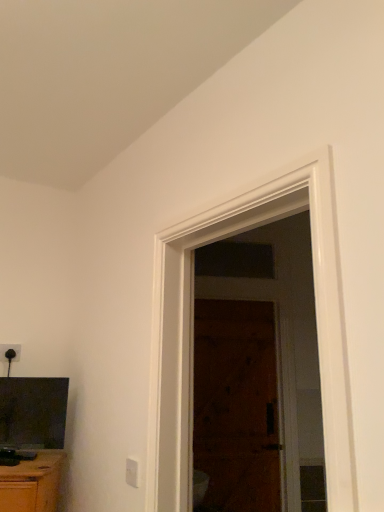
Describe the element at coordinates (33, 439) in the screenshot. I see `matte black tv at lower left` at that location.

What do you see at coordinates (236, 406) in the screenshot?
I see `wooden door at center` at bounding box center [236, 406].

Describe the element at coordinates (258, 372) in the screenshot. The width and height of the screenshot is (384, 512). I see `brown wooden screen door at center` at that location.

The image size is (384, 512). I want to click on white plastic electric outlet at lower center, which is the 2th electric outlet in back-to-front order, so click(x=132, y=472).

Find the location of a particular element. The height and width of the screenshot is (512, 384). electric outlet that is in front of the black plastic electric outlet at upper left, the first electric outlet viewed from the left is located at coordinates (132, 472).

Does white plastic electric outlet at lower center, which is counted as the second electric outlet, starting from the top, contain black plastic electric outlet at upper left, marked as the 2th electric outlet in a front-to-back arrangement?

No, black plastic electric outlet at upper left, marked as the 2th electric outlet in a front-to-back arrangement, is not surrounded by white plastic electric outlet at lower center, which is counted as the second electric outlet, starting from the top.

Which of these two, white plastic electric outlet at lower center, which is the 2th electric outlet in back-to-front order, or black plastic electric outlet at upper left, the 2th electric outlet from the right, stands taller?

white plastic electric outlet at lower center, which is the 2th electric outlet in back-to-front order.

Between white plastic electric outlet at lower center, which is counted as the second electric outlet, starting from the top, and black plastic electric outlet at upper left, the first electric outlet viewed from the left, which one appears on the left side from the viewer's perspective?

Positioned to the left is black plastic electric outlet at upper left, the first electric outlet viewed from the left.

Does point (49, 399) appear closer or farther from the camera than point (220, 348)?

Clearly, point (49, 399) is closer to the camera than point (220, 348).

Between matte black tv at lower left and wooden door at center, which one has less height?

With less height is matte black tv at lower left.

Could you tell me if matte black tv at lower left is turned towards wooden door at center?

No, matte black tv at lower left is not aimed at wooden door at center.

Is there a large distance between matte black tv at lower left and wooden door at center?

Absolutely, matte black tv at lower left is distant from wooden door at center.

How many degrees apart are the facing directions of black plastic electric outlet at upper left, the first electric outlet viewed from the left, and matte black tv at lower left?

The facing directions of black plastic electric outlet at upper left, the first electric outlet viewed from the left, and matte black tv at lower left are 30.1 degrees apart.

Locate an element on the screen. entertainment center below the black plastic electric outlet at upper left, which ranks as the first electric outlet in back-to-front order (from the image's perspective) is located at coordinates (33, 439).

Is black plastic electric outlet at upper left, marked as the 2th electric outlet in a front-to-back arrangement, inside or outside of matte black tv at lower left?

black plastic electric outlet at upper left, marked as the 2th electric outlet in a front-to-back arrangement, is not inside matte black tv at lower left, it's outside.

From the image's perspective, which is below, black plastic electric outlet at upper left, the 2th electric outlet from the right, or matte black tv at lower left?

matte black tv at lower left appears lower in the image.

Considering the positions of objects brown wooden screen door at center and wooden door at center in the image provided, who is in front, brown wooden screen door at center or wooden door at center?

brown wooden screen door at center is more forward.

Is brown wooden screen door at center placed right next to wooden door at center?

Yes, brown wooden screen door at center is touching wooden door at center.

How different are the orientations of brown wooden screen door at center and wooden door at center in degrees?

There is a 0.16-degree angle between the facing directions of brown wooden screen door at center and wooden door at center.

Relative to black plastic electric outlet at upper left, the 1th electric outlet when ordered from top to bottom, is matte black tv at lower left in front or behind?

Visually, matte black tv at lower left is located in front of black plastic electric outlet at upper left, the 1th electric outlet when ordered from top to bottom.

Considering the points (38, 412) and (4, 347), which point is in front, point (38, 412) or point (4, 347)?

The point (38, 412) is closer to the camera.

How far apart are matte black tv at lower left and black plastic electric outlet at upper left, marked as the 2th electric outlet in a front-to-back arrangement?

The distance of matte black tv at lower left from black plastic electric outlet at upper left, marked as the 2th electric outlet in a front-to-back arrangement, is 17.67 inches.

Is matte black tv at lower left turned away from black plastic electric outlet at upper left, which ranks as the first electric outlet in back-to-front order?

No, matte black tv at lower left is not facing the opposite direction of black plastic electric outlet at upper left, which ranks as the first electric outlet in back-to-front order.

Looking at the image, does white plastic electric outlet at lower center, which is the 2th electric outlet in back-to-front order, seem bigger or smaller compared to wooden door at center?

In the image, white plastic electric outlet at lower center, which is the 2th electric outlet in back-to-front order, appears to be smaller than wooden door at center.

From the image's perspective, which is below, white plastic electric outlet at lower center, which is the 2th electric outlet in back-to-front order, or wooden door at center?

wooden door at center is shown below in the image.

How many degrees apart are the facing directions of white plastic electric outlet at lower center, the first electric outlet from the bottom, and wooden door at center?

The facing directions of white plastic electric outlet at lower center, the first electric outlet from the bottom, and wooden door at center are 63.4 degrees apart.

Based on the photo, from a real-world perspective, which object rests below the other?

From a 3D spatial view, white plastic electric outlet at lower center, marked as the 1th electric outlet in a front-to-back arrangement, is below.

From a real-world perspective, who is located higher, brown wooden screen door at center or black plastic electric outlet at upper left, which ranks as the first electric outlet in back-to-front order?

black plastic electric outlet at upper left, which ranks as the first electric outlet in back-to-front order, from a real-world perspective.

Between brown wooden screen door at center and black plastic electric outlet at upper left, the 1th electric outlet when ordered from top to bottom, which one is positioned behind?

brown wooden screen door at center is behind.

From the picture: Between brown wooden screen door at center and black plastic electric outlet at upper left, the first electric outlet viewed from the left, which one has larger width?

brown wooden screen door at center is wider.

Is point (268, 394) positioned after point (6, 353)?

Yes.

You are a GUI agent. You are given a task and a screenshot of the screen. Output one action in this format:
    pyautogui.click(x=<x>, y=<y>)
    Task: Click on the electric outlet located above the white plastic electric outlet at lower center, which is the 2th electric outlet in back-to-front order (from the image's perspective)
    The width and height of the screenshot is (384, 512).
    Given the screenshot: What is the action you would take?
    pyautogui.click(x=10, y=352)

The width and height of the screenshot is (384, 512). In the image, there is a wooden door at center. Find the location of `entertainment center below it (from a real-world perspective)`. entertainment center below it (from a real-world perspective) is located at coordinates (33, 439).

Based on their spatial positions, is wooden door at center or black plastic electric outlet at upper left, the 2th electric outlet from the right, further from brown wooden screen door at center?

Among the two, black plastic electric outlet at upper left, the 2th electric outlet from the right, is located further to brown wooden screen door at center.

From the image, which object appears to be farther from black plastic electric outlet at upper left, the 1th electric outlet when ordered from top to bottom, white plastic electric outlet at lower center, marked as the 1th electric outlet in a front-to-back arrangement, or brown wooden screen door at center?

brown wooden screen door at center is positioned further to the anchor black plastic electric outlet at upper left, the 1th electric outlet when ordered from top to bottom.

Looking at the image, which one is located closer to black plastic electric outlet at upper left, the first electric outlet viewed from the left, wooden door at center or brown wooden screen door at center?

wooden door at center.

Considering their positions, is matte black tv at lower left positioned further to black plastic electric outlet at upper left, the 2th electric outlet from the right, than wooden door at center?

wooden door at center.

In the scene shown: From the image, which object appears to be farther from white plastic electric outlet at lower center, which is counted as the second electric outlet, starting from the top, brown wooden screen door at center or black plastic electric outlet at upper left, the 2th electric outlet from the right?

Based on the image, brown wooden screen door at center appears to be further to white plastic electric outlet at lower center, which is counted as the second electric outlet, starting from the top.

Estimate the real-world distances between objects in this image. Which object is closer to matte black tv at lower left, white plastic electric outlet at lower center, acting as the first electric outlet starting from the right, or brown wooden screen door at center?

white plastic electric outlet at lower center, acting as the first electric outlet starting from the right, lies closer to matte black tv at lower left than the other object.

When comparing their distances from brown wooden screen door at center, does white plastic electric outlet at lower center, which is counted as the second electric outlet, starting from the top, or wooden door at center seem closer?

The object closer to brown wooden screen door at center is wooden door at center.

Looking at the image, which one is located further to black plastic electric outlet at upper left, the 2th electric outlet from the right, brown wooden screen door at center or matte black tv at lower left?

Among the two, brown wooden screen door at center is located further to black plastic electric outlet at upper left, the 2th electric outlet from the right.

Find the location of a particular element. The image size is (384, 512). screen door between white plastic electric outlet at lower center, acting as the first electric outlet starting from the right, and wooden door at center in the front-back direction is located at coordinates (258, 372).

Locate an element on the screen. The image size is (384, 512). door located between black plastic electric outlet at upper left, marked as the 2th electric outlet in a front-to-back arrangement, and brown wooden screen door at center in the left-right direction is located at coordinates (236, 406).

Where is `door between matte black tv at lower left and brown wooden screen door at center`? The height and width of the screenshot is (512, 384). door between matte black tv at lower left and brown wooden screen door at center is located at coordinates (236, 406).

Where is `entertainment center between white plastic electric outlet at lower center, the first electric outlet from the bottom, and wooden door at center in the front-back direction`? The image size is (384, 512). entertainment center between white plastic electric outlet at lower center, the first electric outlet from the bottom, and wooden door at center in the front-back direction is located at coordinates [33, 439].